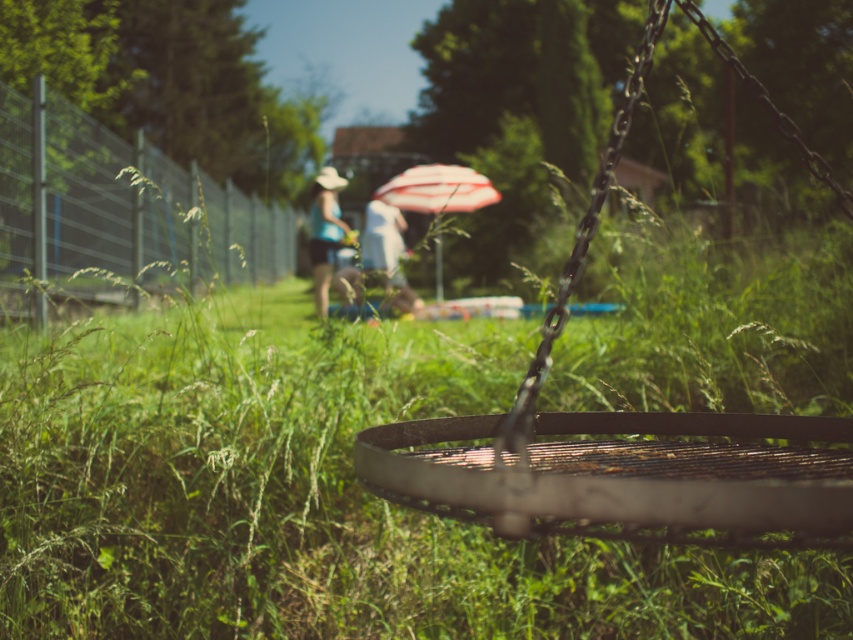
You are planning a picnic in this backyard and want to ensure the person in the matte blue shirt at center stays shaded. Is the striped fabric umbrella at center providing shade over them?

Yes, the striped fabric umbrella at center is positioned over matte blue shirt at center, so it is providing shade over them.

You are standing in the garden and want to hang a small bird feeder. The feeder needs to be placed to the left of the white fabric at center. Can you hang it on the rusty metal swing at center?

The rusty metal swing at center is to the right of the white fabric at center, so hanging the feeder on the rusty metal swing at center would place it to the right of the white fabric at center, not the left as required.

From the picture: You are planning to hang a new piece of art on the wall behind the metallic wire fence at left and the white fabric at center. Based on their positions, which object should you consider first to ensure the art is placed appropriately?

The metallic wire fence at left should be considered first because it is positioned under the white fabric at center, meaning it is closer to the wall. Placing the art behind the metallic wire fence at left first will ensure it aligns correctly with both objects.